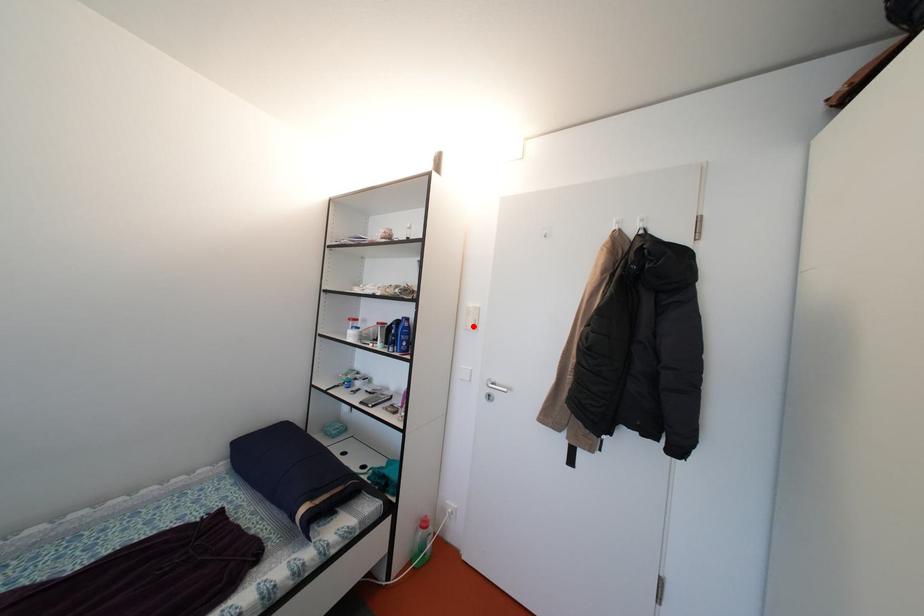
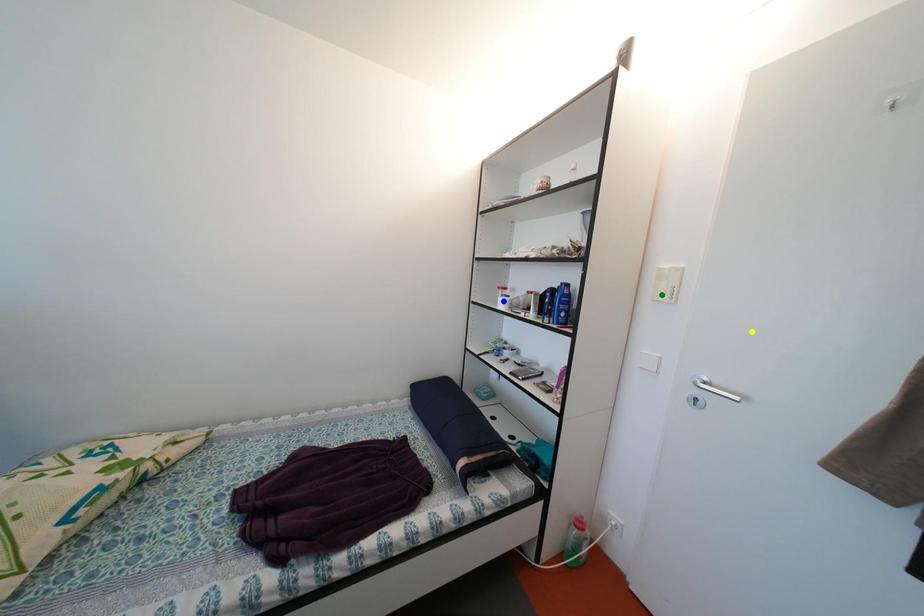
Question: I am providing you with two images of the same scene from different viewpoints. A red point is marked on the first image. You are given multiple points on the second image. Which point in image 2 is actually the same real-world point as the red point in image 1?

Choices:
 (A) yellow point
 (B) green point
 (C) blue point

Answer: (B)